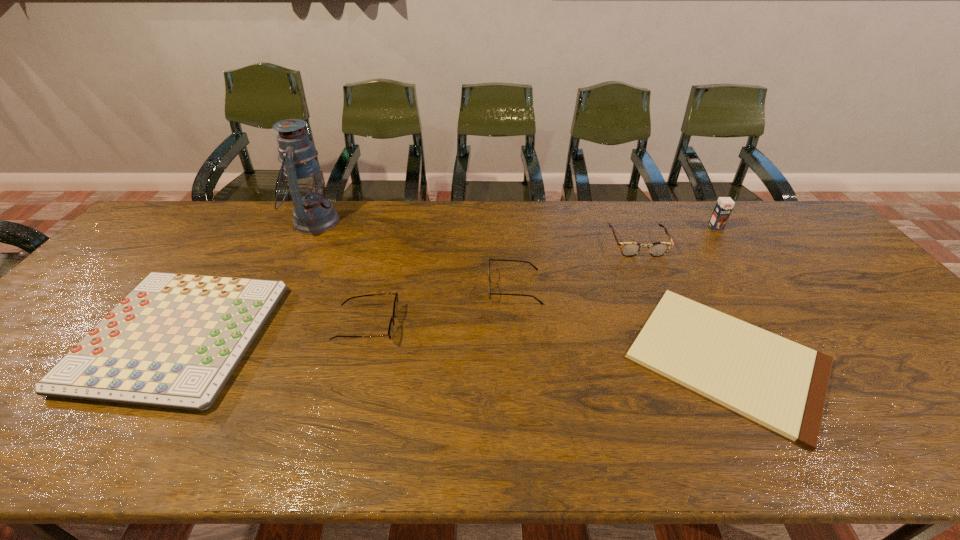
In order to click on spectacles that is at the far edge in this screenshot , I will do `click(629, 249)`.

This screenshot has height=540, width=960. Identify the location of object at the near edge. (782, 385).

Where is `object present at the left edge`? object present at the left edge is located at coordinates (174, 341).

Locate an element on the screen. vacant area at the far edge of the desktop is located at coordinates pos(697,227).

Where is `free space at the near edge of the desktop`? free space at the near edge of the desktop is located at coordinates (214, 437).

This screenshot has width=960, height=540. In the image, there is a desktop. In order to click on free space at the right edge in this screenshot , I will do `click(938, 388)`.

You are a GUI agent. You are given a task and a screenshot of the screen. Output one action in this format:
    pyautogui.click(x=<x>, y=<y>)
    Task: Click on the vacant space at the far left corner of the desktop
    The image size is (960, 540).
    Given the screenshot: What is the action you would take?
    pyautogui.click(x=165, y=235)

I want to click on free space that is in between the second tallest object and the tallest object, so click(x=515, y=225).

Find the location of a particular element. This screenshot has width=960, height=540. free space between the rightmost spectacles and the chocolate milk is located at coordinates (677, 235).

Where is `vacant area that lies between the second tallest object and the second spectacles from left to right`? The image size is (960, 540). vacant area that lies between the second tallest object and the second spectacles from left to right is located at coordinates (615, 257).